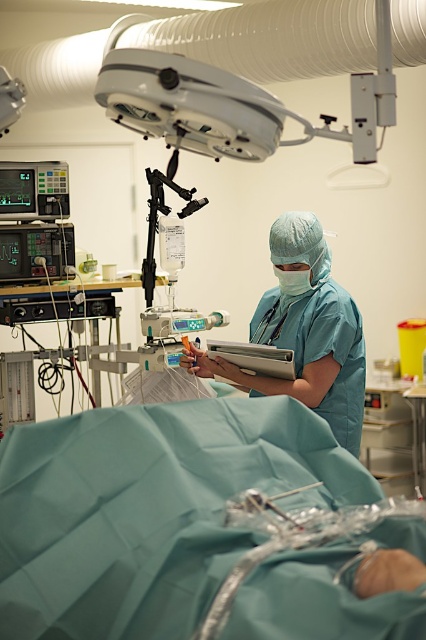
In the scene shown: You are a medical technician in the operating room. You need to adjust the white plastic surgical light at upper center so that it is closer to the camera. How much distance do you need to reduce between them?

The white plastic surgical light at upper center and camera are currently 84.74 centimeters apart. To make them closer, reduce the distance by 84.74 centimeters minus the desired new distance. However, since the exact desired distance isn not specified, the current separation is 84.74 cm.

You are a medical student observing an operation in the operating room. You notice the white plastic surgical light at upper center and the teal matte scrubs at center. Which object is wider?

The teal matte scrubs at center are wider than the white plastic surgical light at upper center.